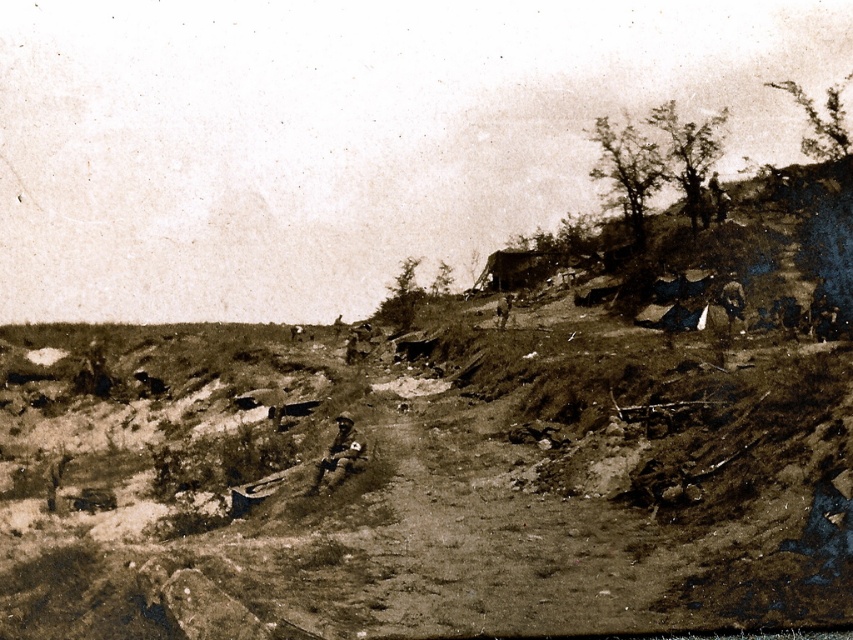
Is dark brown leather jacket at upper right to the left of dark brown leather jacket at center from the viewer's perspective?

In fact, dark brown leather jacket at upper right is to the right of dark brown leather jacket at center.

Between dark brown leather jacket at upper right and dark brown leather jacket at center, which one appears on the left side from the viewer's perspective?

dark brown leather jacket at center

Where is `dark brown leather jacket at upper right`? This screenshot has width=853, height=640. dark brown leather jacket at upper right is located at coordinates (732, 301).

Can you confirm if brown leather jacket at center is smaller than dark brown leather jacket at center?

Yes, brown leather jacket at center is smaller than dark brown leather jacket at center.

Is brown leather jacket at center below dark brown leather jacket at center?

Indeed, brown leather jacket at center is positioned under dark brown leather jacket at center.

Who is more forward, (322, 460) or (502, 300)?

Point (322, 460)

In order to click on brown leather jacket at center in this screenshot , I will do `click(340, 454)`.

Is brown leather jacket at center above dark brown leather jacket at upper right?

Incorrect, brown leather jacket at center is not positioned above dark brown leather jacket at upper right.

Who is more distant from viewer, (350, 417) or (734, 308)?

Point (734, 308)

This screenshot has height=640, width=853. Find the location of `brown leather jacket at center`. brown leather jacket at center is located at coordinates (340, 454).